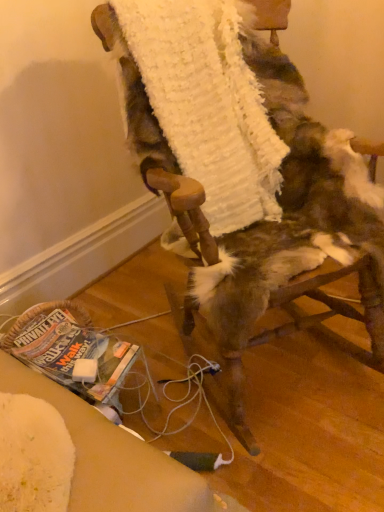
This screenshot has width=384, height=512. Identify the location of fur-covered chair at center. (287, 237).

What do you see at coordinates (287, 237) in the screenshot? This screenshot has height=512, width=384. I see `fur-covered chair at center` at bounding box center [287, 237].

Where is `fur-covered chair at center`? The width and height of the screenshot is (384, 512). fur-covered chair at center is located at coordinates (287, 237).